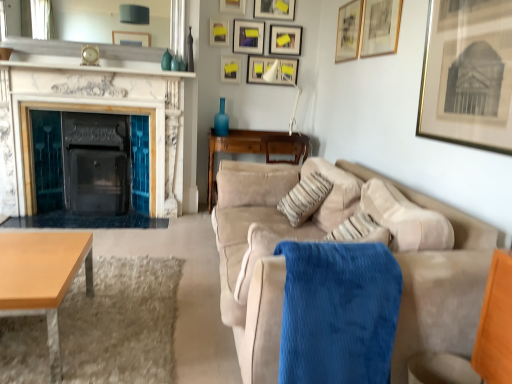
In order to click on matte blue glass vase at upper center, the second vase when ordered from front to back in this screenshot , I will do `click(166, 61)`.

Image resolution: width=512 pixels, height=384 pixels. What do you see at coordinates (255, 150) in the screenshot?
I see `wooden desk at center` at bounding box center [255, 150].

Find the location of a particular element. Image resolution: width=512 pixels, height=384 pixels. light brown wooden coffee table at lower left is located at coordinates (42, 278).

In order to face gold-framed picture at upper right, the second picture frame from the front, should I rotate leftwards or rightwards?

It's best to rotate right around 16.251 degrees.

What do you see at coordinates (380, 27) in the screenshot?
I see `gold-framed picture at upper right, acting as the 9th picture frame starting from the back` at bounding box center [380, 27].

This screenshot has height=384, width=512. I want to click on matte black picture frame at upper center, the 5th picture frame in the front-to-back sequence, so click(274, 9).

The image size is (512, 384). Describe the element at coordinates (274, 9) in the screenshot. I see `matte black picture frame at upper center, arranged as the 6th picture frame when viewed from the back` at that location.

At what (x,y) coordinates should I click in order to perform the action: click on matte white picture frame at upper center, arranged as the fourth picture frame when viewed from the back. Please return your answer as a coordinate pair (x, y). Looking at the image, I should click on (248, 37).

Does point (55, 64) come in front of point (350, 47)?

No, it is not.

Is white marble fireplace at upper center far from gold-framed picture at upper right, which ranks as the 8th picture frame in back-to-front order?

That's right, there is a large distance between white marble fireplace at upper center and gold-framed picture at upper right, which ranks as the 8th picture frame in back-to-front order.

Considering their positions, is white marble fireplace at upper center located in front of or behind gold-framed picture at upper right, the 3th picture frame from the front?

Visually, white marble fireplace at upper center is located behind gold-framed picture at upper right, the 3th picture frame from the front.

From the image's perspective, is wooden armchair at center above wooden desk at center?

Indeed, from the image's perspective, wooden armchair at center is shown above wooden desk at center.

Considering their positions, is wooden armchair at center located in front of or behind wooden desk at center?

In the image, wooden armchair at center appears in front of wooden desk at center.

From a real-world perspective, does wooden armchair at center sit lower than wooden desk at center?

Actually, wooden armchair at center is physically above wooden desk at center in the real world.

Can you tell me how much wooden armchair at center and wooden desk at center differ in facing direction?

They differ by 177 degrees in their facing directions.

From the image's perspective, which object appears higher, matte white picture frame at upper center, the seventh picture frame when ordered from front to back, or beige suede couch at right?

matte white picture frame at upper center, the seventh picture frame when ordered from front to back, appears higher in the image.

Would you say matte white picture frame at upper center, arranged as the fourth picture frame when viewed from the back, is to the left or to the right of beige suede couch at right in the picture?

matte white picture frame at upper center, arranged as the fourth picture frame when viewed from the back, is positioned on beige suede couch at right's left side.

Does matte white picture frame at upper center, arranged as the fourth picture frame when viewed from the back, have a greater height compared to beige suede couch at right?

No, matte white picture frame at upper center, arranged as the fourth picture frame when viewed from the back, is not taller than beige suede couch at right.

Can you tell me how much matte black picture frame at upper center, which appears as the third picture frame when viewed from the back, and white plastic lamp at upper center differ in facing direction?

matte black picture frame at upper center, which appears as the third picture frame when viewed from the back, and white plastic lamp at upper center are facing 0.782 degrees away from each other.

Looking at the image, does matte black picture frame at upper center, which appears as the third picture frame when viewed from the back, seem bigger or smaller compared to white plastic lamp at upper center?

Considering their sizes, matte black picture frame at upper center, which appears as the third picture frame when viewed from the back, takes up less space than white plastic lamp at upper center.

Which of these two, matte black picture frame at upper center, which appears as the third picture frame when viewed from the back, or white plastic lamp at upper center, stands taller?

white plastic lamp at upper center.

Relative to matte blue glass vase at upper center, positioned as the third vase in back-to-front order, is matte teal vase at upper center, the fourth vase viewed from the back, in front or behind?

Clearly, matte teal vase at upper center, the fourth vase viewed from the back, is in front of matte blue glass vase at upper center, positioned as the third vase in back-to-front order.

Is matte teal vase at upper center, positioned as the 2th vase in left-to-right order, not near matte blue glass vase at upper center, the 4th vase in the right-to-left sequence?

No, matte teal vase at upper center, positioned as the 2th vase in left-to-right order, is not far from matte blue glass vase at upper center, the 4th vase in the right-to-left sequence.

Considering the sizes of objects matte teal vase at upper center, positioned as the 2th vase in left-to-right order, and matte blue glass vase at upper center, the second vase when ordered from front to back, in the image provided, who is smaller, matte teal vase at upper center, positioned as the 2th vase in left-to-right order, or matte blue glass vase at upper center, the second vase when ordered from front to back,?

matte teal vase at upper center, positioned as the 2th vase in left-to-right order, is smaller.

From a real-world perspective, which is physically below, matte teal vase at upper center, placed as the 3th vase when sorted from right to left, or matte blue glass vase at upper center, the second vase when ordered from front to back?

In real-world perspective, matte teal vase at upper center, placed as the 3th vase when sorted from right to left, is lower.

Which is more to the right, wooden desk at center or matte teal vase at upper center, the fourth vase viewed from the back?

wooden desk at center is more to the right.

Are wooden desk at center and matte teal vase at upper center, the fourth vase viewed from the back, located far from each other?

wooden desk at center is far away from matte teal vase at upper center, the fourth vase viewed from the back.

Is wooden desk at center oriented towards matte teal vase at upper center, the first vase viewed from the front?

No, wooden desk at center is not facing towards matte teal vase at upper center, the first vase viewed from the front.

From a real-world perspective, is wooden desk at center over matte teal vase at upper center, the fourth vase viewed from the back?

Incorrect, from a real-world perspective, wooden desk at center is lower than matte teal vase at upper center, the fourth vase viewed from the back.

Starting from the marble fireplace at left, which picture frame is the 2nd one to the right? Please provide its 2D coordinates.

[(231, 68)]

Considering the relative positions of marble fireplace at left and matte black picture frame at upper center, which appears as the third picture frame when viewed from the back, in the image provided, is marble fireplace at left to the right of matte black picture frame at upper center, which appears as the third picture frame when viewed from the back, from the viewer's perspective?

No, marble fireplace at left is not to the right of matte black picture frame at upper center, which appears as the third picture frame when viewed from the back.

Can you tell me how much marble fireplace at left and matte black picture frame at upper center, the eighth picture frame positioned from the front, differ in facing direction?

marble fireplace at left and matte black picture frame at upper center, the eighth picture frame positioned from the front, are facing 0.562 degrees away from each other.

From the picture: From the image's perspective, which is above, marble fireplace at left or matte black picture frame at upper center, which appears as the third picture frame when viewed from the back?

matte black picture frame at upper center, which appears as the third picture frame when viewed from the back, from the image's perspective.

What are the coordinates of `mantle that is under the gold-framed picture at upper right, which ranks as the 8th picture frame in back-to-front order (from a real-world perspective)` in the screenshot? It's located at (101, 68).

Where is `desk lying below the wooden armchair at center (from the image's perspective)`? The width and height of the screenshot is (512, 384). desk lying below the wooden armchair at center (from the image's perspective) is located at coordinates (255, 150).

Based on their spatial positions, is blue glass vase at center, positioned as the first vase in right-to-left order, or blue corduroy blanket at center closer to matte teal vase at upper center, the fourth vase viewed from the back?

The object closer to matte teal vase at upper center, the fourth vase viewed from the back, is blue glass vase at center, positioned as the first vase in right-to-left order.

Based on their spatial positions, is white plastic lamp at upper center or matte blue glass vase at upper center, positioned as the third vase in back-to-front order, closer to matte black picture frame at upper center, the eighth picture frame positioned from the front?

white plastic lamp at upper center.

Based on their spatial positions, is matte white picture frame at upper center, the 7th picture frame from the back, or wooden armchair at center further from gold-framed print at upper right, the first picture frame from the front?

matte white picture frame at upper center, the 7th picture frame from the back, lies further to gold-framed print at upper right, the first picture frame from the front, than the other object.

Looking at the image, which one is located further to matte blue glass vase at upper center, positioned as the third vase in back-to-front order, beige suede couch at right or marble fireplace at left?

beige suede couch at right lies further to matte blue glass vase at upper center, positioned as the third vase in back-to-front order, than the other object.

From the image, which object appears to be farther from matte white picture frame at upper center, the 10th picture frame viewed from the front, gold-framed print at upper right, which is counted as the 10th picture frame, starting from the back, or wooden desk at center?

Based on the image, gold-framed print at upper right, which is counted as the 10th picture frame, starting from the back, appears to be further to matte white picture frame at upper center, the 10th picture frame viewed from the front.

When comparing their distances from matte gold picture frame at upper center, which is the 5th picture frame from back to front, does wooden table at lower left or blue glass vase at center, the fourth vase from the left, seem further?

Among the two, wooden table at lower left is located further to matte gold picture frame at upper center, which is the 5th picture frame from back to front.

From the image, which object appears to be nearer to gold-framed picture at upper right, which ranks as the 8th picture frame in back-to-front order, wooden armchair at center or matte blue glass vase at upper center, the second vase when ordered from front to back?

Based on the image, wooden armchair at center appears to be nearer to gold-framed picture at upper right, which ranks as the 8th picture frame in back-to-front order.

From the image, which object appears to be farther from beige fabric pillow at center, matte gold picture frame at upper center, which is the 5th picture frame from back to front, or matte black picture frame at upper center, the 5th picture frame in the front-to-back sequence?

Among the two, matte black picture frame at upper center, the 5th picture frame in the front-to-back sequence, is located further to beige fabric pillow at center.

Locate an element on the screen. coffee table positioned between gold-framed print at upper right, the first picture frame from the front, and wooden armchair at center from near to far is located at coordinates (42, 278).

Find the location of `pillow between light brown wooden coffee table at lower left and white plastic lamp at upper center from front to back`. pillow between light brown wooden coffee table at lower left and white plastic lamp at upper center from front to back is located at coordinates click(x=305, y=198).

At what (x,y) coordinates should I click in order to perform the action: click on armchair that lies between white plastic lamp at upper center and wooden desk at center from top to bottom. Please return your answer as a coordinate pair (x, y). This screenshot has width=512, height=384. Looking at the image, I should click on (286, 147).

Locate an element on the screen. The image size is (512, 384). coffee table between gold-framed print at upper right, the first picture frame from the front, and matte black picture frame at upper center, arranged as the 6th picture frame when viewed from the back, from front to back is located at coordinates (42, 278).